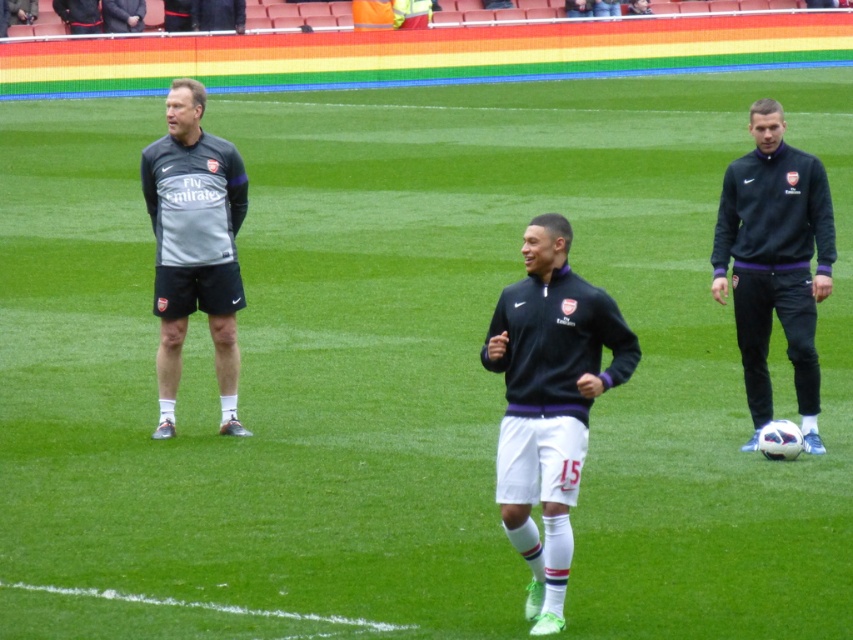
Question: Does dark blue jersey at right appear over gray matte jacket at left?

Choices:
 (A) yes
 (B) no

Answer: (B)

Question: Estimate the real-world distances between objects in this image. Which object is closer to the gray matte jacket at left?

Choices:
 (A) black matte jacket at center
 (B) dark blue jersey at right

Answer: (B)

Question: Can you confirm if black matte jacket at center is wider than dark blue jersey at right?

Choices:
 (A) yes
 (B) no

Answer: (B)

Question: Which of these objects is positioned farthest from the gray matte jacket at left?

Choices:
 (A) dark blue jersey at right
 (B) black matte jacket at center

Answer: (B)

Question: Which object is farther from the camera taking this photo?

Choices:
 (A) black matte jacket at center
 (B) gray matte jacket at left

Answer: (B)

Question: Is black matte jacket at center further to the viewer compared to gray matte jacket at left?

Choices:
 (A) yes
 (B) no

Answer: (B)